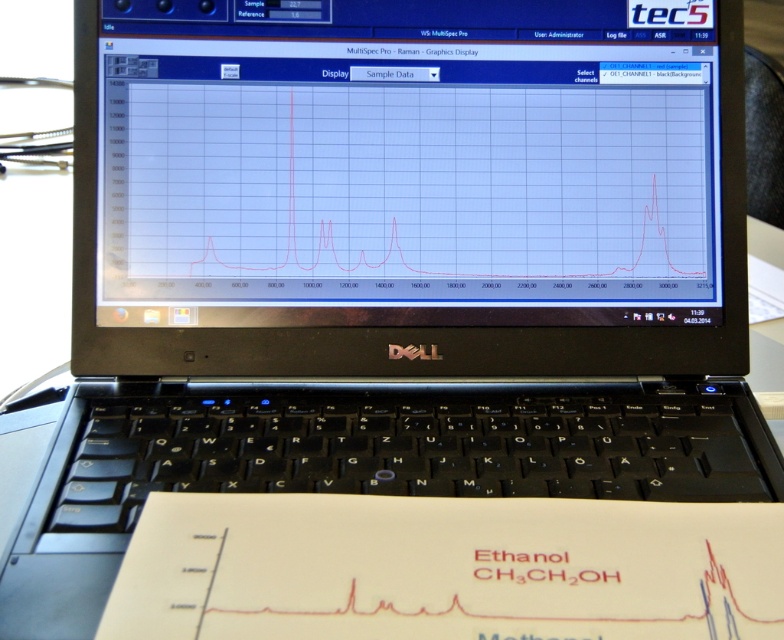
You are a researcher analyzing data on a Dell laptop. You need to compare the height of the matte black screen at center and the white paper at lower center to determine which one is taller. Based on the scene description, which object is taller?

The matte black screen at center has a greater height compared to the white paper at lower center, so the matte black screen at center is taller.

You are a technician using a Dell laptop to analyze Raman spectroscopy data. You need to adjust the graph displayed on the screen to ensure that the point at coordinates point (639, 124) is clearly visible. The software interface has a zoom tool that allows you to magnify specific areas of the graph. What is the minimum distance in inches between the point and the camera that you should set the zoom tool to achieve this visibility?

The point (639, 124) and the camera are 22.92 inches apart from each other. Therefore, to ensure the point is clearly visible, the zoom tool should be set to a minimum distance of 22.92 inches.

You are a technician analyzing the Dell laptop screen. What are the coordinates of the matte black screen at center in the image?

The coordinates of the matte black screen at center are at point (407,163).